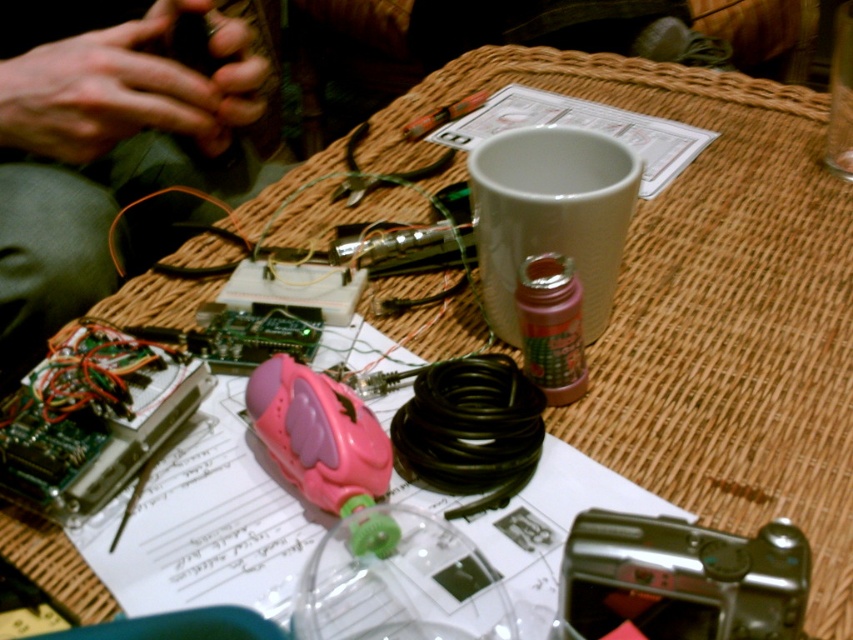
Question: Which of the following is the closest to the observer?

Choices:
 (A) (590, 196)
 (B) (53, 161)
 (C) (602, 538)
 (D) (444, 109)

Answer: (C)

Question: Which point is farther from the camera taking this photo?

Choices:
 (A) (428, 129)
 (B) (218, 74)

Answer: (A)

Question: Which object appears closest to the camera in this image?

Choices:
 (A) white ceramic cup at upper center
 (B) green fabric hands at upper left

Answer: (A)

Question: Does white ceramic cup at upper center lie in front of metallic silver tool at upper center?

Choices:
 (A) no
 (B) yes

Answer: (B)

Question: Is white ceramic cup at upper center in front of metallic silver tool at upper center?

Choices:
 (A) no
 (B) yes

Answer: (B)

Question: Can you confirm if black plastic camera at lower right is bigger than black rubber wire at center?

Choices:
 (A) no
 (B) yes

Answer: (A)